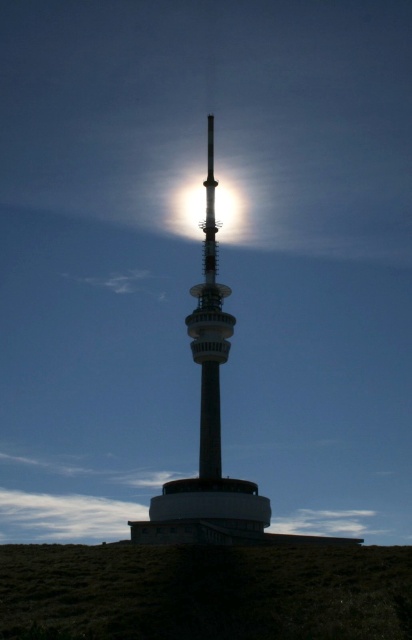
Which of these two, green grassy hillside at lower center or silvery metallic tower at center, stands taller?

Standing taller between the two is silvery metallic tower at center.

Does green grassy hillside at lower center have a larger size compared to silvery metallic tower at center?

No, green grassy hillside at lower center is not bigger than silvery metallic tower at center.

Between point (344, 572) and point (133, 525), which one is positioned behind?

Positioned behind is point (133, 525).

Where is `green grassy hillside at lower center`? The height and width of the screenshot is (640, 412). green grassy hillside at lower center is located at coordinates (206, 592).

Can you confirm if silvery metallic tower at center is positioned above bright metallic tower at center?

No.

Does point (205, 237) lie behind point (205, 196)?

No, (205, 237) is in front of (205, 196).

Who is more forward, (236, 538) or (231, 212)?

Positioned in front is point (236, 538).

I want to click on silvery metallic tower at center, so click(x=206, y=424).

Consider the image. Is green grassy hillside at lower center behind bright metallic tower at center?

That is False.

Is point (271, 636) less distant than point (182, 205)?

Yes.

Locate an element on the screen. green grassy hillside at lower center is located at coordinates (206, 592).